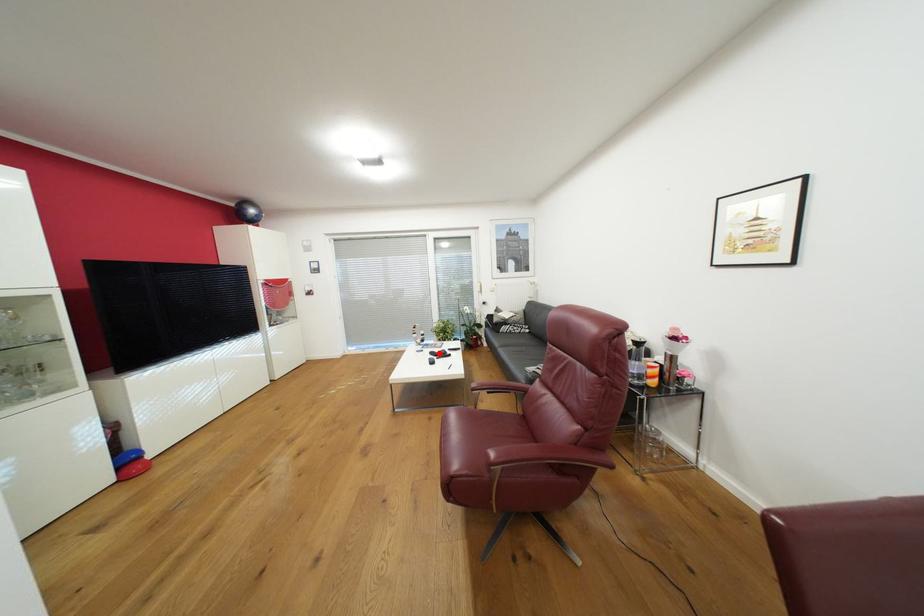
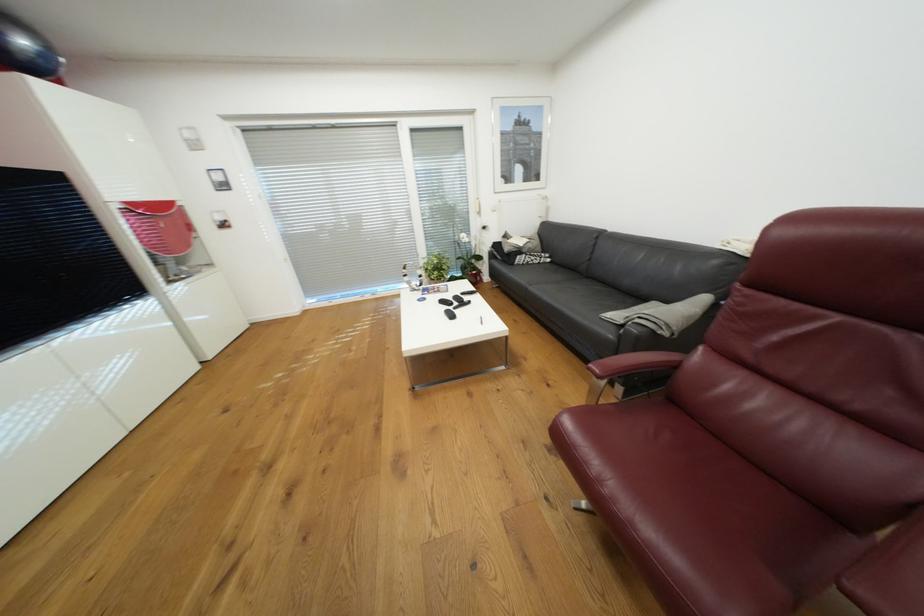
Locate, in the second image, the point that corresponds to the highlighted location in the first image.

(448, 302)